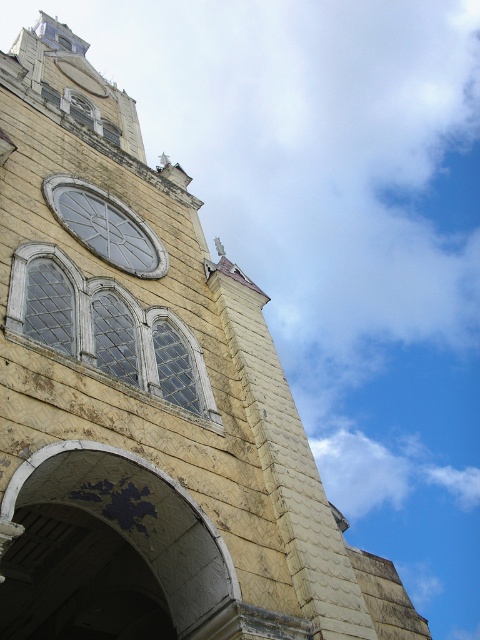
You are standing in front of the historic stone building and want to take a photo. You notice two points on the building labeled as point [96,310] and point [157,320]. Which point appears closer to your camera lens when capturing the building?

Point [96,310] is closer to the camera than point [157,320], so it will appear closer in the photo.

You are standing in front of the historic stone building and want to take a photo of the clear glass window at upper left. To ensure the window is centered in your camera viewfinder, where should you aim your camera? Provide the coordinates as a point in the format of point followed by the numbers in parentheses.

You should aim your camera at point (x=48, y=300) to center the clear glass window at upper left in your viewfinder.